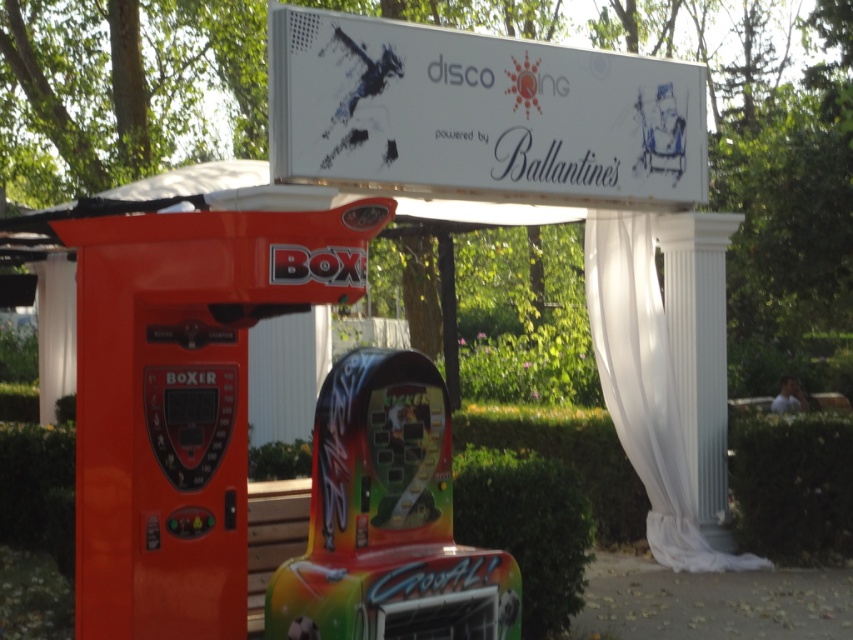
Question: Does white glossy sign at upper center appear on the left side of shiny plastic arcade machine at center?

Choices:
 (A) yes
 (B) no

Answer: (B)

Question: Does orange plastic vending machine at left appear on the left side of white sheer curtain at center?

Choices:
 (A) yes
 (B) no

Answer: (A)

Question: Is the position of white sheer curtain at center more distant than that of green leafy hedge at right?

Choices:
 (A) no
 (B) yes

Answer: (A)

Question: Which point is closer to the camera?

Choices:
 (A) green leafy hedge at right
 (B) white marble column at center

Answer: (A)

Question: Which of these objects is positioned farthest from the green leafy hedge at right?

Choices:
 (A) shiny plastic arcade machine at center
 (B) orange plastic vending machine at left
 (C) white glossy sign at upper center

Answer: (B)

Question: Which object is closer to the camera taking this photo?

Choices:
 (A) green leafy hedge at center
 (B) orange plastic vending machine at left

Answer: (B)